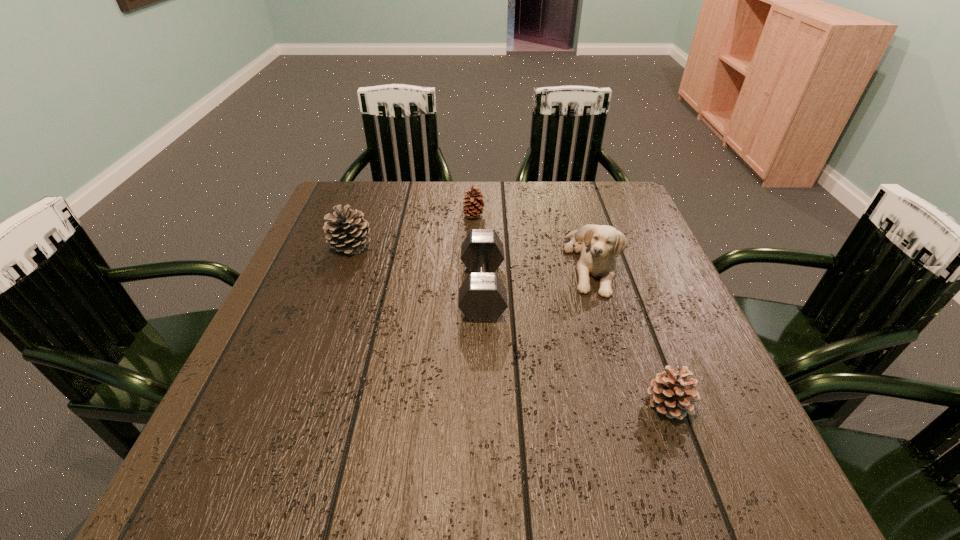
This screenshot has width=960, height=540. Find the location of `puppy`. puppy is located at coordinates (599, 245).

Where is `the leftmost pinecone`? the leftmost pinecone is located at coordinates (346, 230).

Locate an element on the screen. The width and height of the screenshot is (960, 540). the leftmost object is located at coordinates (346, 230).

At what (x,y) coordinates should I click in order to perform the action: click on the farthest pinecone. Please return your answer as a coordinate pair (x, y). Image resolution: width=960 pixels, height=540 pixels. Looking at the image, I should click on (475, 206).

Where is `the second pinecone from right to left`? This screenshot has width=960, height=540. the second pinecone from right to left is located at coordinates (475, 206).

I want to click on dumbbell, so click(482, 297).

I want to click on the nearest pinecone, so click(x=671, y=393).

The width and height of the screenshot is (960, 540). I want to click on the nearest object, so click(671, 393).

Where is `blank space located on the front-facing side of the puppy`? This screenshot has height=540, width=960. blank space located on the front-facing side of the puppy is located at coordinates (652, 467).

Identify the location of vacant region located on the back of the second farthest pinecone. (372, 189).